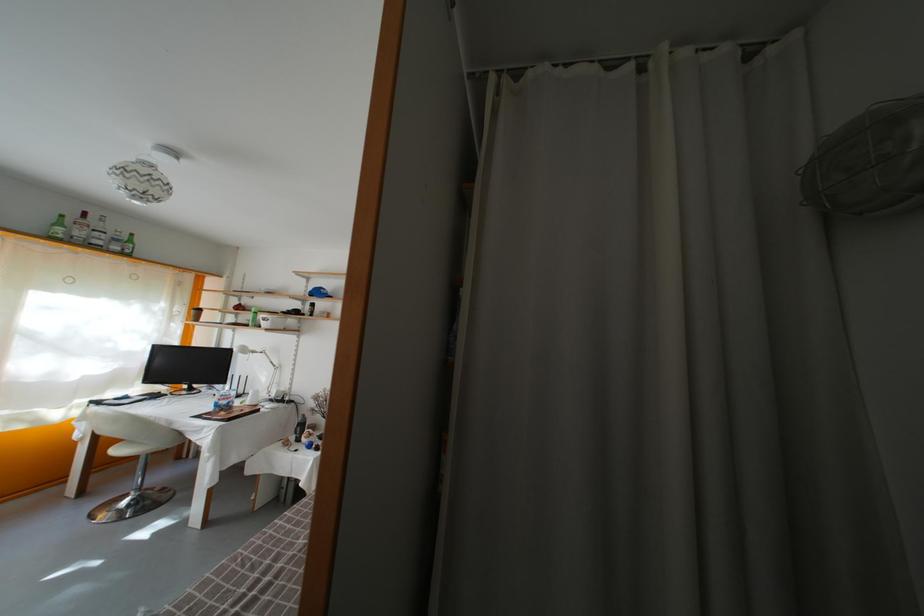
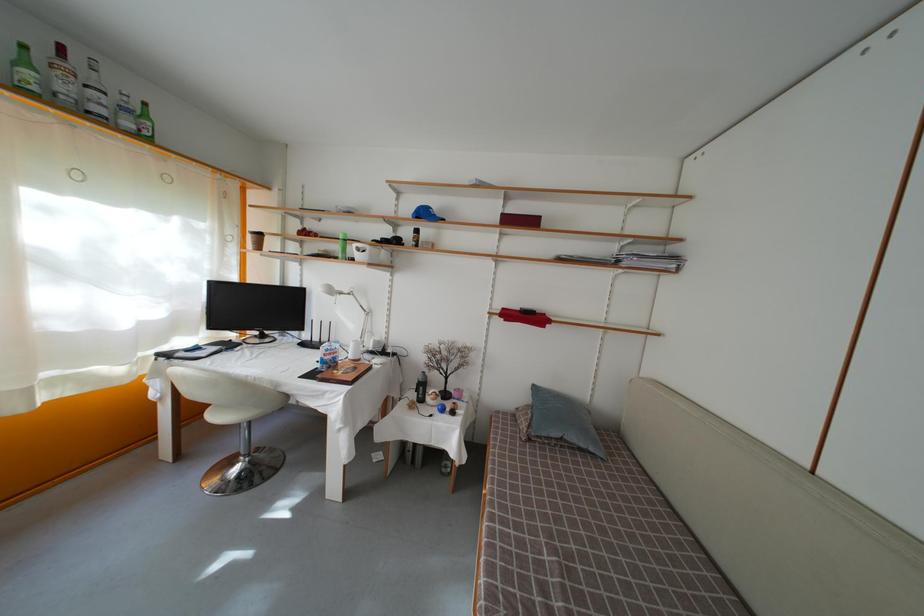
Question: I am providing you with two images of the same scene from different viewpoints. Please identify which objects are invisible in image2.

Choices:
 (A) green spray bottle
 (B) black water bottle
 (C) green glass bottle
 (D) none of these

Answer: (D)